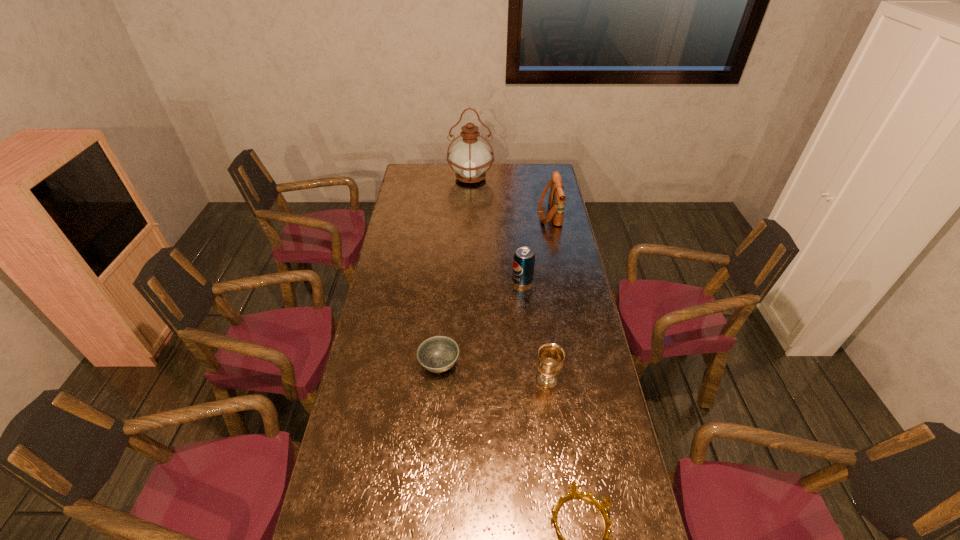
Image resolution: width=960 pixels, height=540 pixels. What are the coordinates of `vacant space located on the front of the fourth nearest object` in the screenshot? It's located at (525, 310).

At what (x,y) coordinates should I click in order to perform the action: click on vacant space positioned on the back of the chalice. Please return your answer as a coordinate pair (x, y). Image resolution: width=960 pixels, height=540 pixels. Looking at the image, I should click on (543, 348).

At what (x,y) coordinates should I click in order to perform the action: click on free location located on the left of the bowl. Please return your answer as a coordinate pair (x, y). Looking at the image, I should click on (377, 363).

Where is `object that is at the far edge`? This screenshot has width=960, height=540. object that is at the far edge is located at coordinates (470, 158).

Find the location of a particular element. The height and width of the screenshot is (540, 960). shoulder bag that is at the right edge is located at coordinates (557, 197).

Locate an element on the screen. chalice located in the right edge section of the desktop is located at coordinates pos(550,360).

Find the location of a particular element. free location at the far edge is located at coordinates (516, 170).

The image size is (960, 540). In the image, there is a desktop. Find the location of `free space at the left edge`. free space at the left edge is located at coordinates (400, 379).

In the image, there is a desktop. At what (x,y) coordinates should I click in order to perform the action: click on vacant region at the right edge. Please return your answer as a coordinate pair (x, y). The height and width of the screenshot is (540, 960). Looking at the image, I should click on (567, 340).

Identify the location of free space at the far left corner of the desktop. (415, 182).